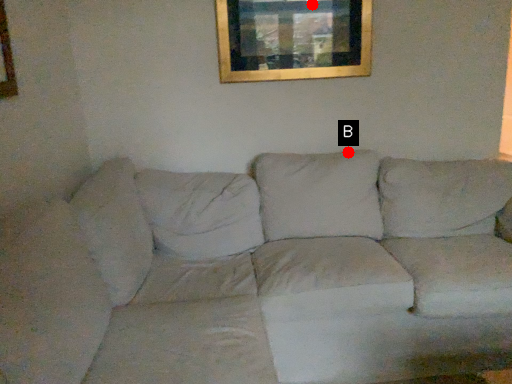
Question: Two points are circled on the image, labeled by A and B beside each circle. Which of the following is the farthest from the observer?

Choices:
 (A) A is further
 (B) B is further

Answer: (B)